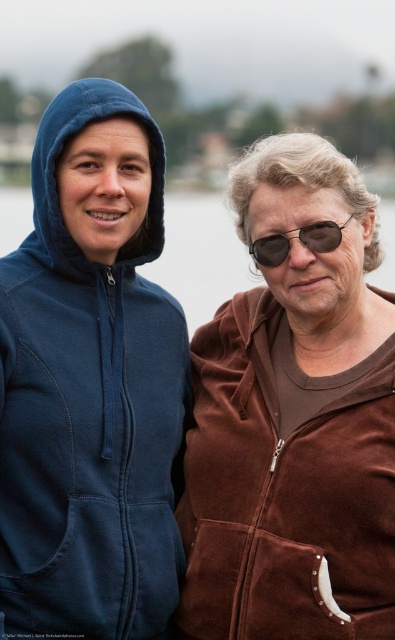
Can you confirm if brown suede jacket at right is taller than sunglasses at right?

Correct, brown suede jacket at right is much taller as sunglasses at right.

This screenshot has height=640, width=395. What do you see at coordinates (282, 496) in the screenshot?
I see `brown suede jacket at right` at bounding box center [282, 496].

Locate an element on the screen. Image resolution: width=395 pixels, height=640 pixels. brown suede jacket at right is located at coordinates pyautogui.click(x=282, y=496).

Does matte blue hoodie at left come in front of sunglasses at right?

That is True.

Does matte blue hoodie at left have a lesser width compared to sunglasses at right?

Incorrect, matte blue hoodie at left's width is not less than sunglasses at right's.

This screenshot has height=640, width=395. What do you see at coordinates (90, 384) in the screenshot?
I see `matte blue hoodie at left` at bounding box center [90, 384].

The height and width of the screenshot is (640, 395). What are the coordinates of `matte blue hoodie at left` in the screenshot? It's located at (90, 384).

Can you confirm if matte blue hoodie at left is positioned to the left of brown suede jacket at right?

Yes, matte blue hoodie at left is to the left of brown suede jacket at right.

This screenshot has width=395, height=640. What do you see at coordinates (90, 384) in the screenshot?
I see `matte blue hoodie at left` at bounding box center [90, 384].

What do you see at coordinates (90, 384) in the screenshot?
I see `matte blue hoodie at left` at bounding box center [90, 384].

What are the coordinates of `matte blue hoodie at left` in the screenshot? It's located at (90, 384).